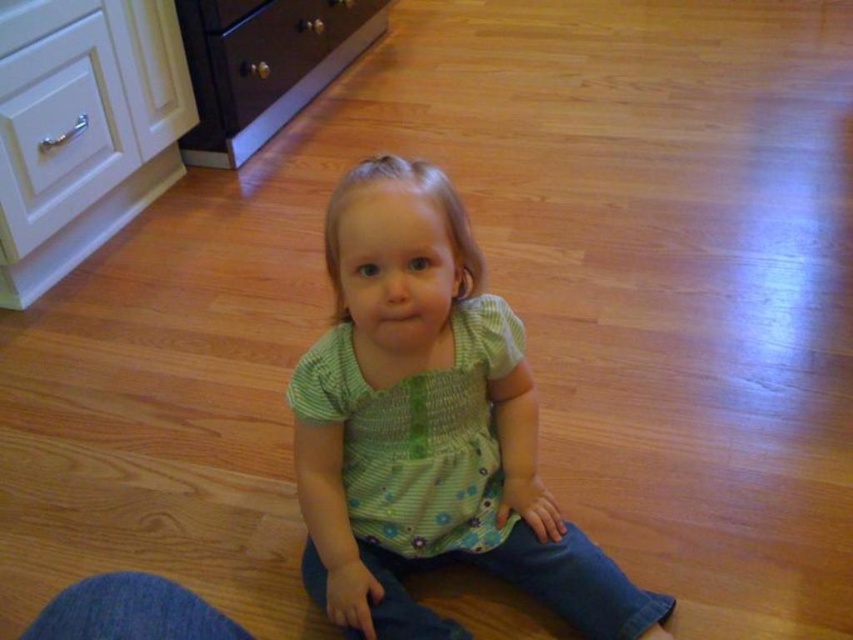
Which is in front, point (10, 205) or point (242, 22)?

Point (10, 205) is in front.

Find the location of a particular element. white glossy dresser at upper left is located at coordinates (83, 129).

This screenshot has height=640, width=853. Describe the element at coordinates (83, 129) in the screenshot. I see `white glossy dresser at upper left` at that location.

Find the location of a particular element. The height and width of the screenshot is (640, 853). white glossy dresser at upper left is located at coordinates coord(83,129).

The image size is (853, 640). Describe the element at coordinates (430, 428) in the screenshot. I see `green floral shirt at center` at that location.

Who is more distant from viewer, [556,525] or [71,218]?

The point [71,218] is behind.

Which is behind, point (326, 388) or point (16, 150)?

The point (16, 150) is more distant.

Locate an element on the screen. green floral shirt at center is located at coordinates (430, 428).

Who is positioned more to the left, green floral shirt at center or matte dark brown drawer at upper center?

matte dark brown drawer at upper center

Can you confirm if green floral shirt at center is shorter than matte dark brown drawer at upper center?

Yes, green floral shirt at center is shorter than matte dark brown drawer at upper center.

Is point (447, 374) closer to camera compared to point (321, 13)?

Yes, point (447, 374) is closer to viewer.

At what (x,y) coordinates should I click in order to perform the action: click on green floral shirt at center. Please return your answer as a coordinate pair (x, y). This screenshot has height=640, width=853. Looking at the image, I should click on coord(430,428).